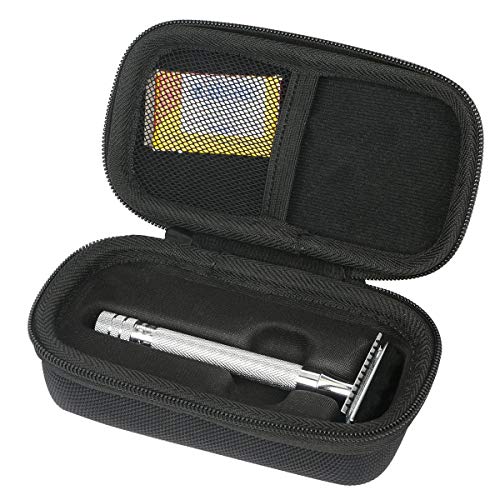
Locate an element on the screen. This screenshot has height=500, width=500. razor holder is located at coordinates pyautogui.click(x=279, y=394).